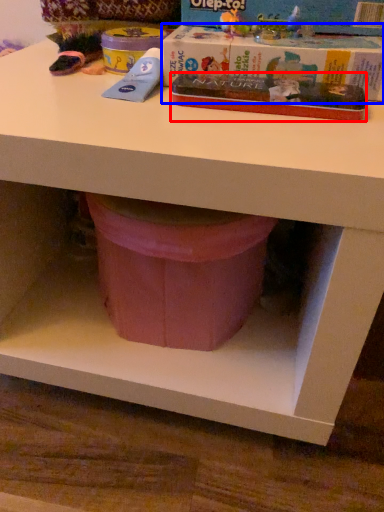
Question: Which point is closer to the camera, paperback book (highlighted by a red box) or paperback book (highlighted by a blue box)?

Choices:
 (A) paperback book
 (B) paperback book

Answer: (A)